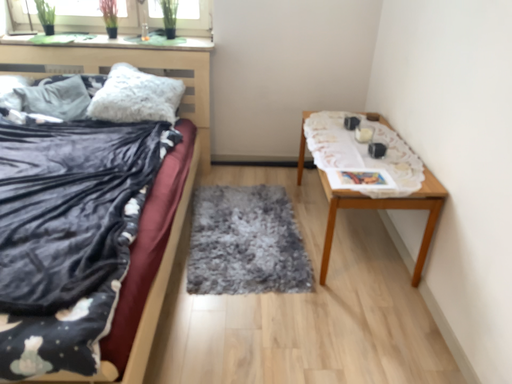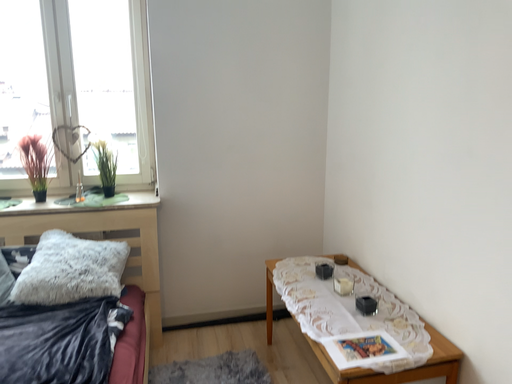
Question: How did the camera likely rotate when shooting the video?

Choices:
 (A) rotated upward
 (B) rotated downward

Answer: (A)